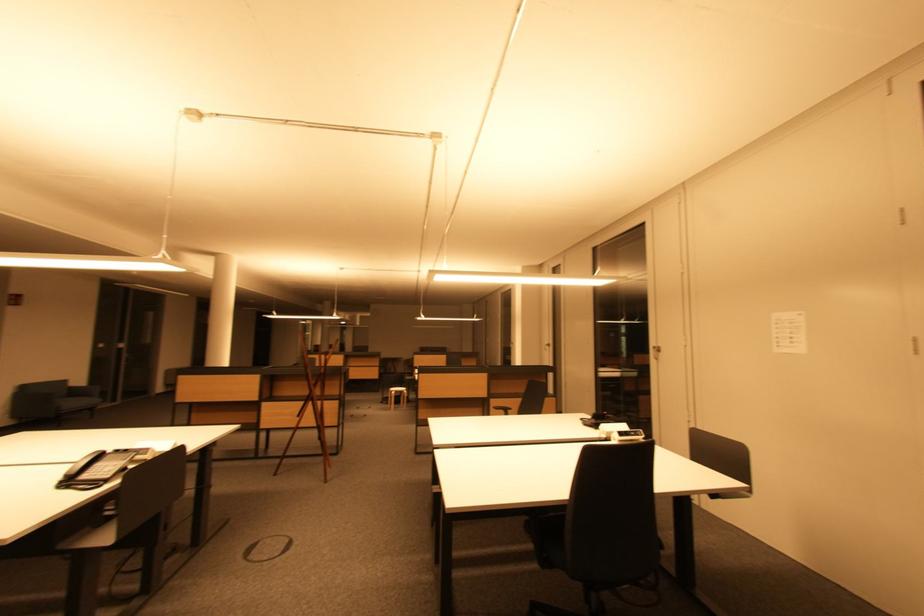
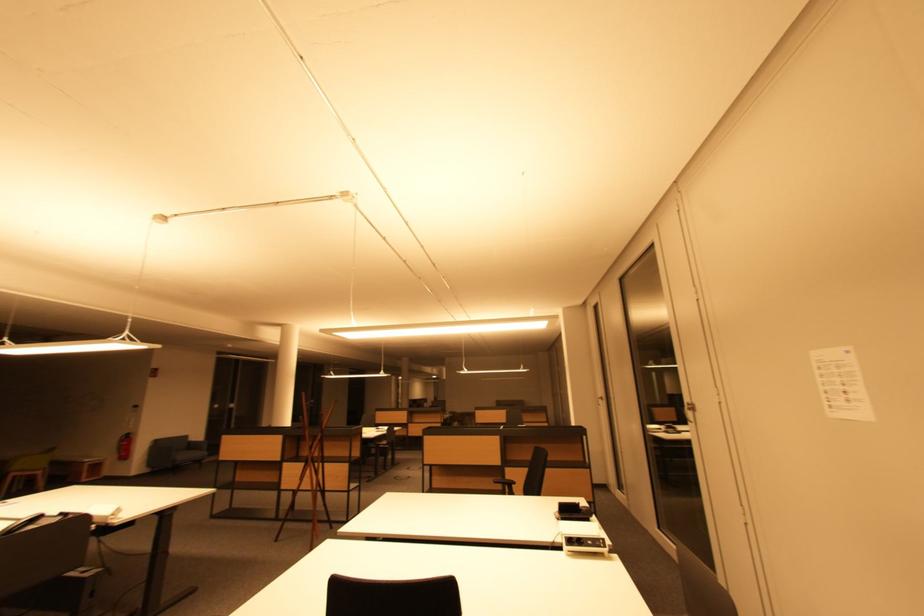
Where in the second image is the point corresponding to (553,347) from the first image?

(605, 400)